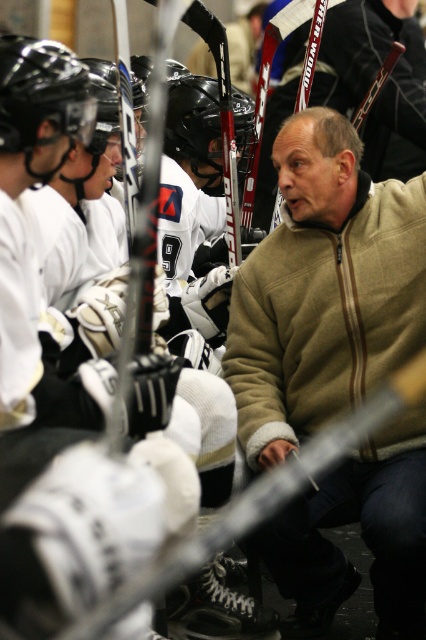
Question: Which object appears closest to the camera in this image?

Choices:
 (A) beige fleece jacket at center
 (B) black matte helmet at center

Answer: (A)

Question: Which point is farther to the camera?

Choices:
 (A) (247, 156)
 (B) (14, 72)
 (C) (356, 136)

Answer: (A)

Question: Does beige fleece jacket at center appear on the left side of black matte helmet at center?

Choices:
 (A) yes
 (B) no

Answer: (B)

Question: Which object is farther from the camera taking this photo?

Choices:
 (A) black matte helmet at left
 (B) beige fleece jacket at center
 (C) black matte helmet at center

Answer: (C)

Question: Is beige fleece jacket at center smaller than black matte helmet at left?

Choices:
 (A) yes
 (B) no

Answer: (A)

Question: Does black matte helmet at left have a smaller size compared to black matte helmet at center?

Choices:
 (A) no
 (B) yes

Answer: (B)